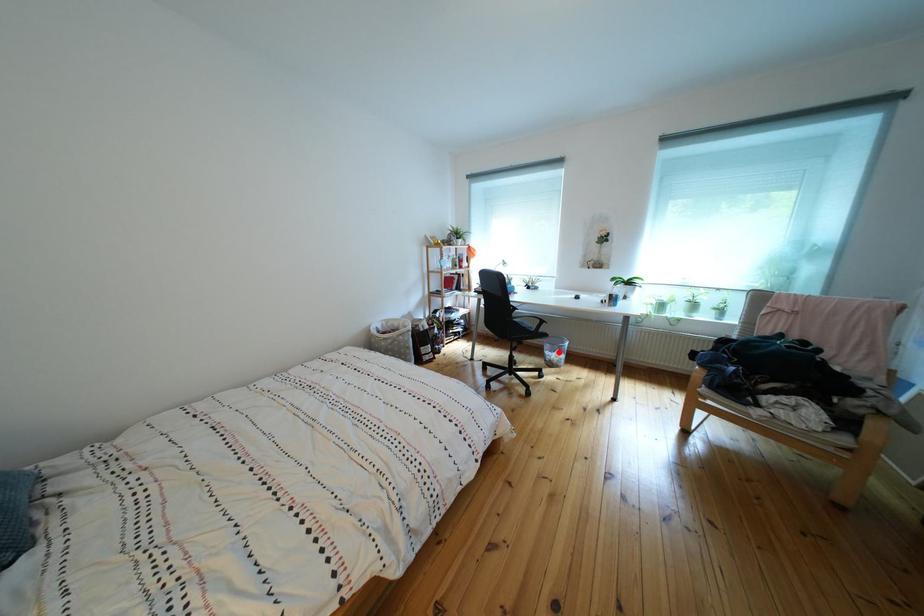
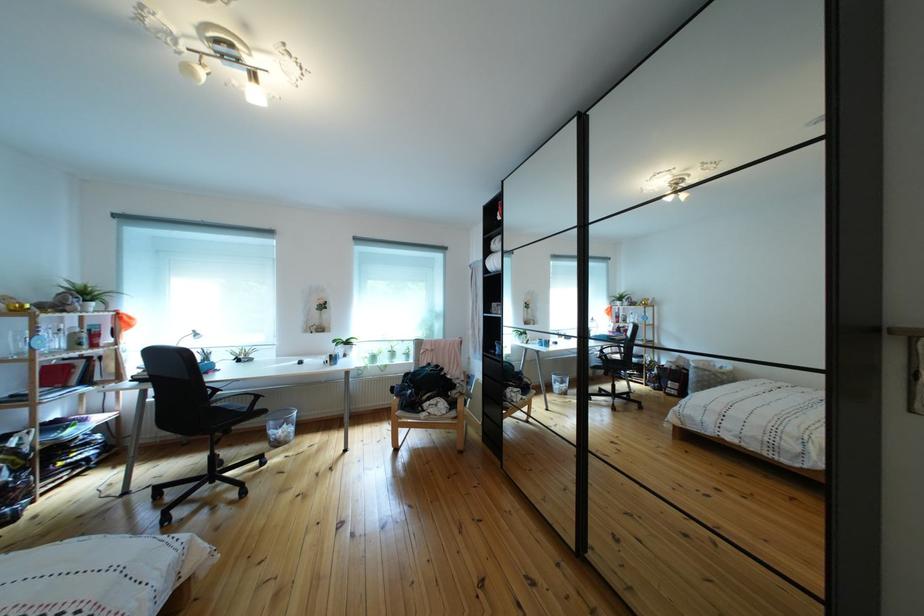
Question: I am providing you with two images of the same scene from different viewpoints. Given a red point in image1, look at the same physical point in image2. Is it:

Choices:
 (A) Closer to the viewpoint
 (B) Farther from the viewpoint

Answer: (A)